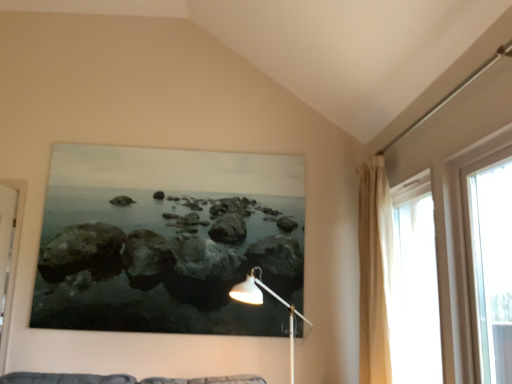
Question: Could you tell me if white metal floor lamp at lower center is turned towards transparent glass window at right, which is the first window in front-to-back order?

Choices:
 (A) no
 (B) yes

Answer: (A)

Question: Are white metal floor lamp at lower center and transparent glass window at right, acting as the second window starting from the back, beside each other?

Choices:
 (A) yes
 (B) no

Answer: (B)

Question: From the image's perspective, is white metal floor lamp at lower center under transparent glass window at right, acting as the second window starting from the back?

Choices:
 (A) yes
 (B) no

Answer: (A)

Question: From the image's perspective, is white metal floor lamp at lower center on top of transparent glass window at right, which is the first window in front-to-back order?

Choices:
 (A) no
 (B) yes

Answer: (A)

Question: Considering the relative positions of white metal floor lamp at lower center and transparent glass window at right, acting as the second window starting from the back, in the image provided, is white metal floor lamp at lower center in front of transparent glass window at right, acting as the second window starting from the back,?

Choices:
 (A) yes
 (B) no

Answer: (B)

Question: Considering their positions, is beige fabric curtain at right located in front of or behind translucent fabric curtain at right, the 2th window when ordered from front to back?

Choices:
 (A) front
 (B) behind

Answer: (B)

Question: Considering the positions of beige fabric curtain at right and translucent fabric curtain at right, the 2th window when ordered from front to back, in the image, is beige fabric curtain at right wider or thinner than translucent fabric curtain at right, the 2th window when ordered from front to back,?

Choices:
 (A) thin
 (B) wide

Answer: (B)

Question: From the image's perspective, is beige fabric curtain at right above or below translucent fabric curtain at right, the first window in the back-to-front sequence?

Choices:
 (A) below
 (B) above

Answer: (B)

Question: From a real-world perspective, relative to translucent fabric curtain at right, the first window in the back-to-front sequence, is beige fabric curtain at right vertically above or below?

Choices:
 (A) below
 (B) above

Answer: (B)

Question: Does point (376, 314) appear closer or farther from the camera than point (450, 291)?

Choices:
 (A) farther
 (B) closer

Answer: (A)

Question: In terms of size, does beige fabric curtain at right appear bigger or smaller than transparent glass window at right, which is the first window in front-to-back order?

Choices:
 (A) small
 (B) big

Answer: (B)

Question: From the image's perspective, relative to transparent glass window at right, which is the first window in front-to-back order, is beige fabric curtain at right above or below?

Choices:
 (A) below
 (B) above

Answer: (A)

Question: Is beige fabric curtain at right inside the boundaries of transparent glass window at right, which is the first window in front-to-back order, or outside?

Choices:
 (A) inside
 (B) outside

Answer: (B)

Question: From a real-world perspective, is transparent glass window at right, acting as the second window starting from the back, above or below beige fabric curtain at right?

Choices:
 (A) above
 (B) below

Answer: (A)

Question: Is transparent glass window at right, acting as the second window starting from the back, in front of or behind beige fabric curtain at right in the image?

Choices:
 (A) behind
 (B) front

Answer: (B)